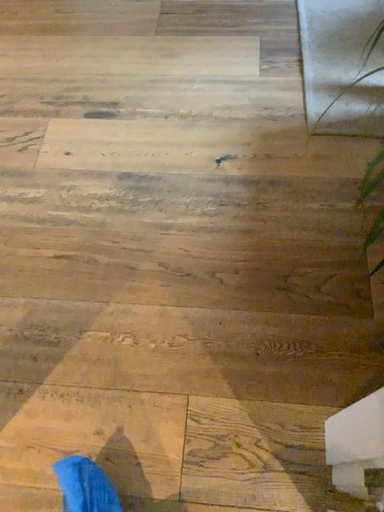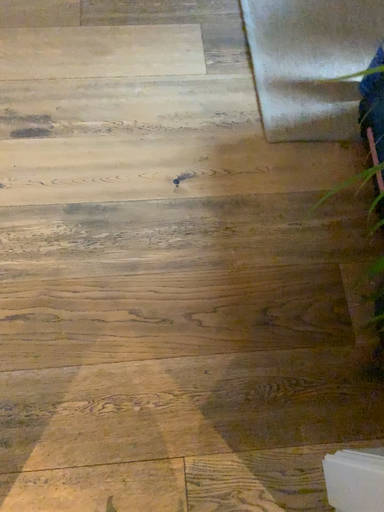
Question: How did the camera likely rotate when shooting the video?

Choices:
 (A) rotated upward
 (B) rotated downward

Answer: (B)